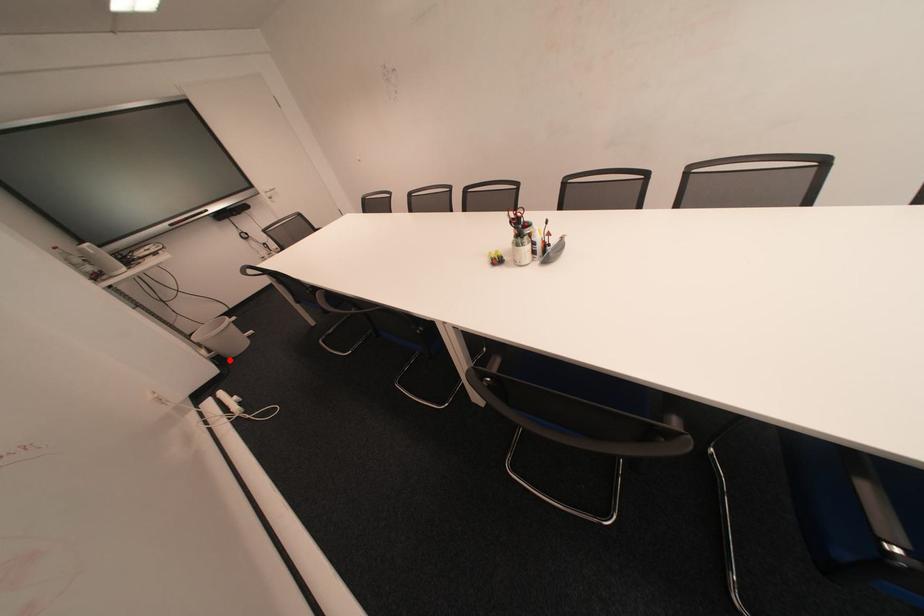
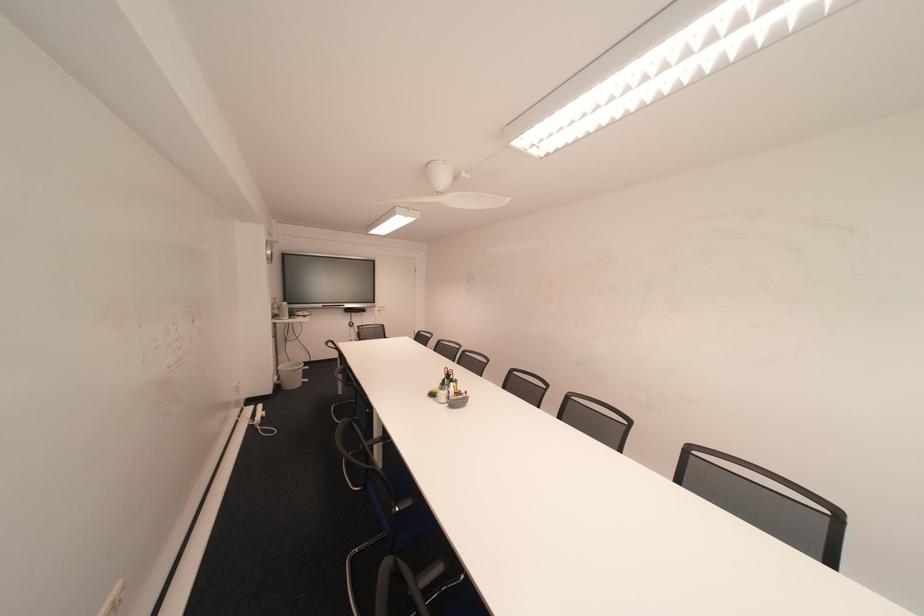
The point at the highlighted location is marked in the first image. Where is the corresponding point in the second image?

(288, 387)